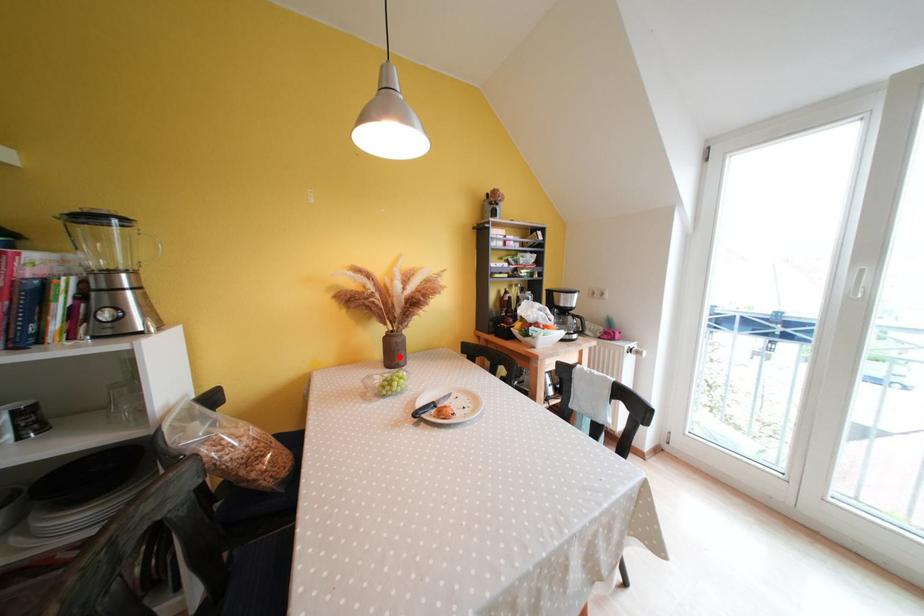
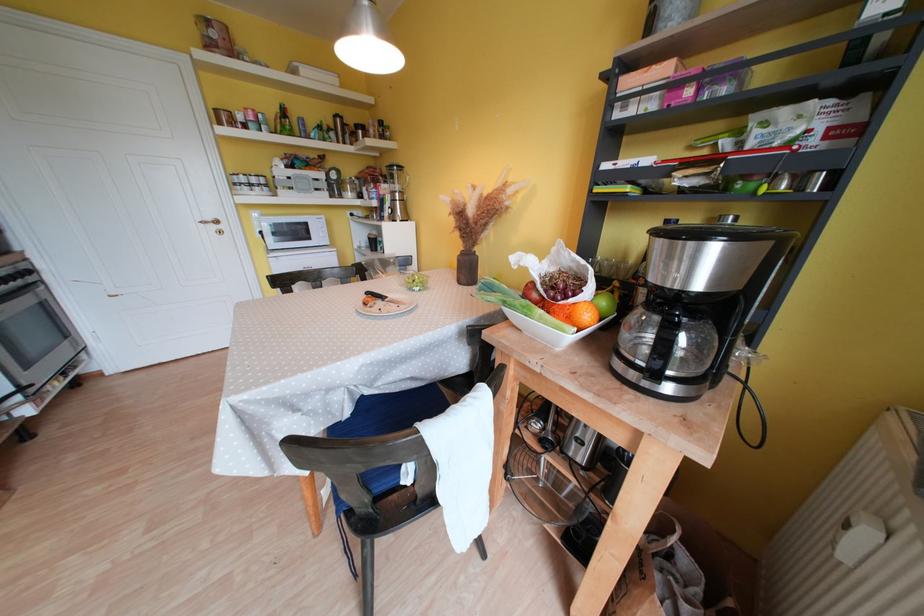
Locate, in the second image, the point that corresponds to the highlighted location in the first image.

(472, 275)